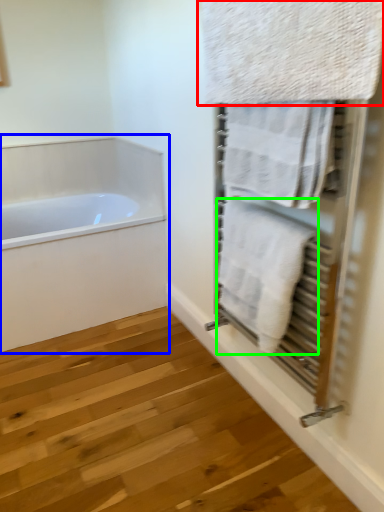
Question: Estimate the real-world distances between objects in this image. Which object is farther from towel (highlighted by a red box), bathtub (highlighted by a blue box) or towel (highlighted by a green box)?

Choices:
 (A) bathtub
 (B) towel

Answer: (A)